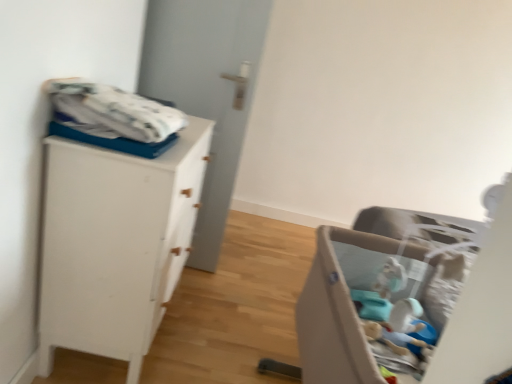
Question: From a real-world perspective, relative to white matte cabinet at left, is beige fabric playpen at lower right vertically above or below?

Choices:
 (A) above
 (B) below

Answer: (B)

Question: From the image's perspective, is beige fabric playpen at lower right located above or below white matte cabinet at left?

Choices:
 (A) above
 (B) below

Answer: (B)

Question: Which of these objects is positioned farthest from the white matte door at center?

Choices:
 (A) white matte cabinet at left
 (B) beige fabric playpen at lower right
 (C) white cotton blanket at upper left

Answer: (B)

Question: Which object is positioned farthest from the beige fabric playpen at lower right?

Choices:
 (A) white matte cabinet at left
 (B) white cotton blanket at upper left
 (C) white matte door at center

Answer: (C)